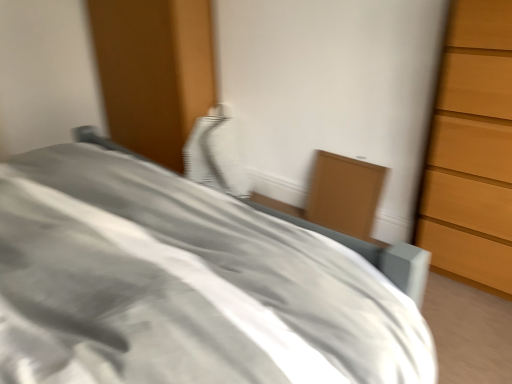
Question: Considering the relative sizes of matte wood cabinet at center-right and white textured pillow at center in the image provided, is matte wood cabinet at center-right wider than white textured pillow at center?

Choices:
 (A) no
 (B) yes

Answer: (A)

Question: Can you confirm if matte wood cabinet at center-right is bigger than white textured pillow at center?

Choices:
 (A) no
 (B) yes

Answer: (A)

Question: Would you consider matte wood cabinet at center-right to be distant from white textured pillow at center?

Choices:
 (A) yes
 (B) no

Answer: (B)

Question: Are matte wood cabinet at center-right and white textured pillow at center beside each other?

Choices:
 (A) yes
 (B) no

Answer: (B)

Question: Can we say matte wood cabinet at center-right lies outside white textured pillow at center?

Choices:
 (A) no
 (B) yes

Answer: (B)

Question: From a real-world perspective, is gray fabric bed at center positioned above or below matte wood cabinet at center-right?

Choices:
 (A) below
 (B) above

Answer: (B)

Question: Considering the positions of gray fabric bed at center and matte wood cabinet at center-right in the image, is gray fabric bed at center taller or shorter than matte wood cabinet at center-right?

Choices:
 (A) tall
 (B) short

Answer: (A)

Question: Based on their positions, is gray fabric bed at center located to the left or right of matte wood cabinet at center-right?

Choices:
 (A) left
 (B) right

Answer: (A)

Question: In terms of size, does gray fabric bed at center appear bigger or smaller than matte wood cabinet at center-right?

Choices:
 (A) big
 (B) small

Answer: (A)

Question: In terms of width, does matte wood cabinet at center-right look wider or thinner when compared to gray fabric bed at center?

Choices:
 (A) thin
 (B) wide

Answer: (A)

Question: Is point (360, 188) positioned closer to the camera than point (267, 332)?

Choices:
 (A) farther
 (B) closer

Answer: (A)

Question: From their relative heights in the image, would you say matte wood cabinet at center-right is taller or shorter than gray fabric bed at center?

Choices:
 (A) tall
 (B) short

Answer: (B)

Question: Considering the positions of matte wood cabinet at center-right and gray fabric bed at center in the image, is matte wood cabinet at center-right bigger or smaller than gray fabric bed at center?

Choices:
 (A) small
 (B) big

Answer: (A)

Question: Is gray fabric bed at center wider or thinner than white textured pillow at center?

Choices:
 (A) thin
 (B) wide

Answer: (B)

Question: Does point (352, 263) appear closer or farther from the camera than point (222, 134)?

Choices:
 (A) farther
 (B) closer

Answer: (B)